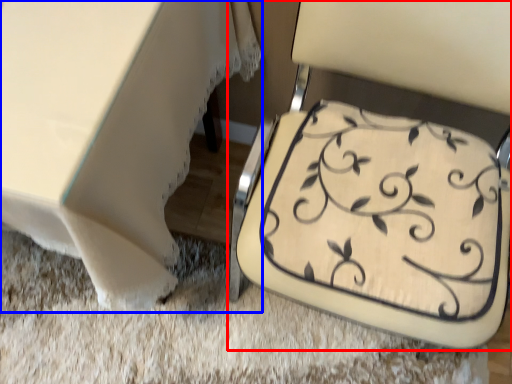
Question: Which of the following is the farthest to the observer, chair (highlighted by a red box) or table (highlighted by a blue box)?

Choices:
 (A) chair
 (B) table

Answer: (B)